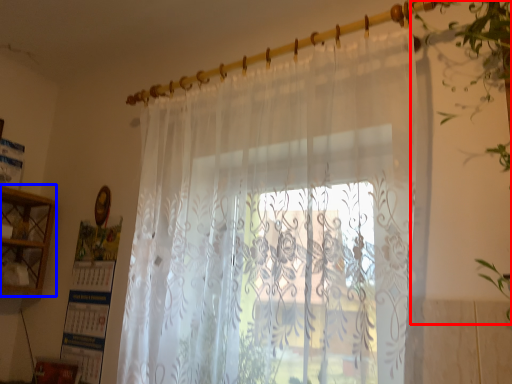
Question: Which object appears farthest to the camera in this image, vegetation (highlighted by a red box) or cabinet (highlighted by a blue box)?

Choices:
 (A) vegetation
 (B) cabinet

Answer: (B)